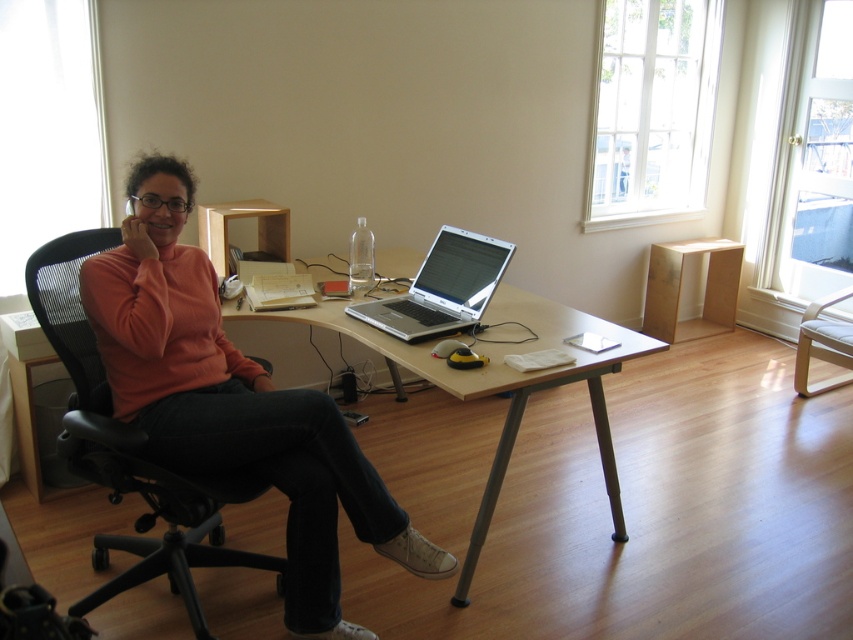
Which is more to the left, matte orange sweater at center or silver metallic laptop at center?

Positioned to the left is matte orange sweater at center.

Identify the location of matte orange sweater at center. The width and height of the screenshot is (853, 640). (233, 403).

Does point (607, 452) come farther from viewer compared to point (480, 266)?

Yes, point (607, 452) is farther from viewer.

Measure the distance from silver metallic table at center to silver metallic laptop at center.

silver metallic table at center is 8.74 inches from silver metallic laptop at center.

This screenshot has height=640, width=853. What are the coordinates of `silver metallic table at center` in the screenshot? It's located at point(498,380).

Does black mesh office chair at left have a smaller size compared to silver metallic table at center?

Indeed, black mesh office chair at left has a smaller size compared to silver metallic table at center.

Can you confirm if black mesh office chair at left is positioned to the right of silver metallic table at center?

No, black mesh office chair at left is not to the right of silver metallic table at center.

The height and width of the screenshot is (640, 853). What are the coordinates of `black mesh office chair at left` in the screenshot? It's located at (128, 449).